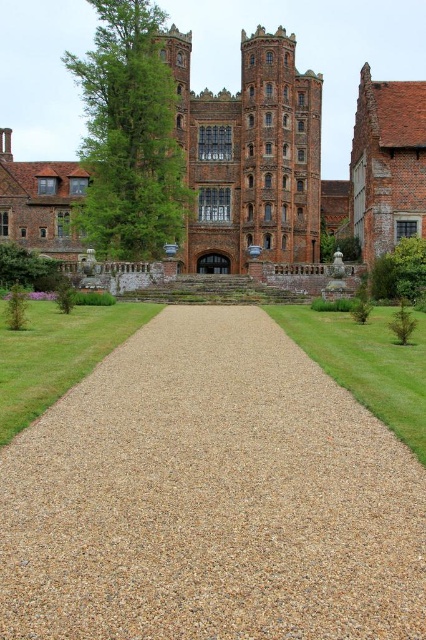
You are standing at the entrance of the grand historic building and want to walk to the brown gravel at center. Which direction should you head towards?

You should head towards the center of the scene to reach the brown gravel at center, as it is located at point coordinates of [210,497].

You are standing at the entrance of the historic building and want to walk towards the green grass at center. Which direction should you turn to avoid the brown gravel at center?

The brown gravel at center is on the left side of the green grass at center, so you should turn to the right to avoid it and head towards the green grass at center.

You are a gardener planning to plant flowers along the driveway. You have two options for the flower bed location. One is near the brown gravel at center, and the other is near the green grass at lower left. Which location would be closer to the main entrance of the historic building?

The brown gravel at center is in front of green grass at lower left, so the brown gravel at center is closer to the main entrance.